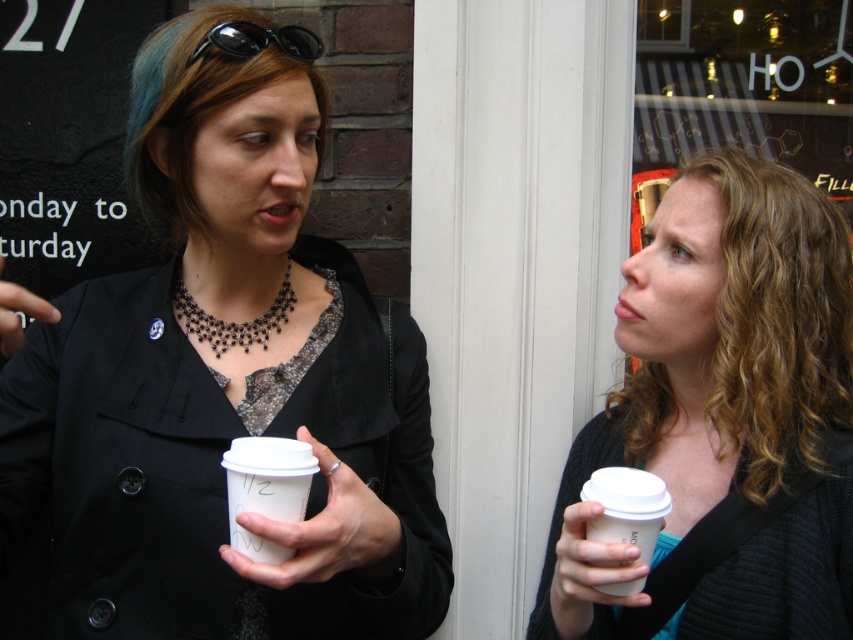
Question: Which point is farther from the camera taking this photo?

Choices:
 (A) (283, 556)
 (B) (786, 584)
 (C) (247, 348)
 (D) (669, 508)

Answer: (C)

Question: Can you confirm if matte black coffee cup at right is smaller than black rubber goggles at upper left?

Choices:
 (A) yes
 (B) no

Answer: (B)

Question: From the image, what is the correct spatial relationship of matte black coffee cup at right in relation to black rubber goggles at upper left?

Choices:
 (A) right
 (B) left

Answer: (A)

Question: Estimate the real-world distances between objects in this image. Which object is closer to the matte black coffee cup at right?

Choices:
 (A) black beaded necklace at center
 (B) white paper cup at right

Answer: (B)

Question: Which point appears farthest from the camera in this image?

Choices:
 (A) (248, 472)
 (B) (837, 476)
 (C) (225, 42)
 (D) (260, 333)

Answer: (D)

Question: Is matte black coffee cup at right smaller than white paper cup at right?

Choices:
 (A) no
 (B) yes

Answer: (A)